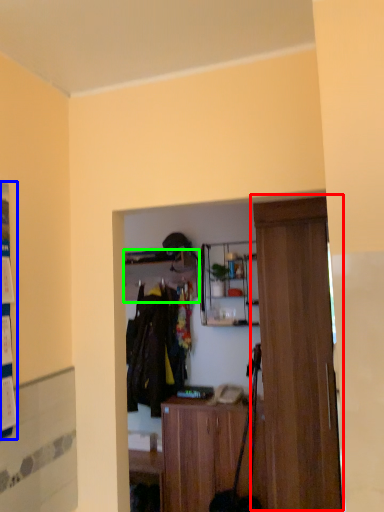
Question: Estimate the real-world distances between objects in this image. Which object is farther from door (highlighted by a red box), poster (highlighted by a blue box) or shelf (highlighted by a green box)?

Choices:
 (A) poster
 (B) shelf

Answer: (A)